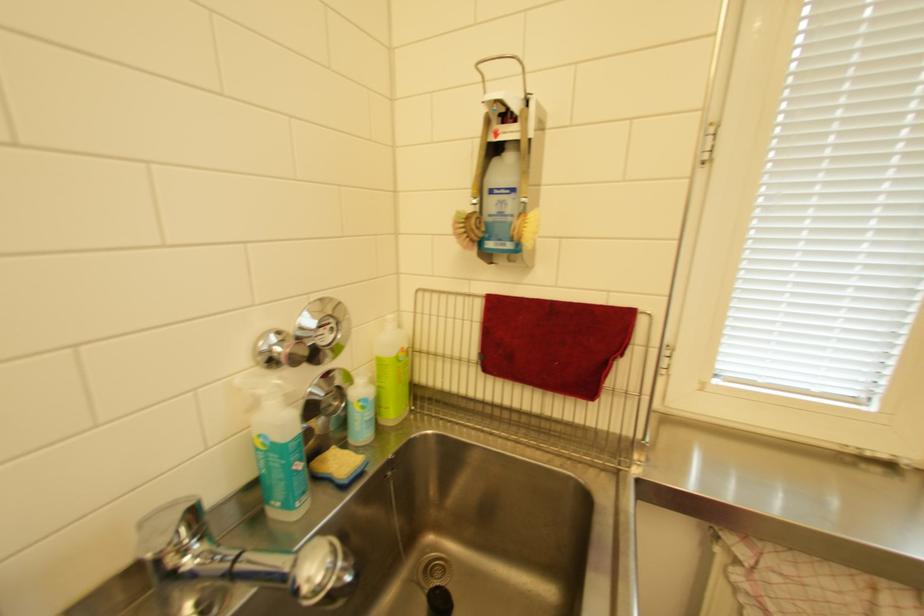
Where is `silver faucet handle`? silver faucet handle is located at coordinates (161, 527).